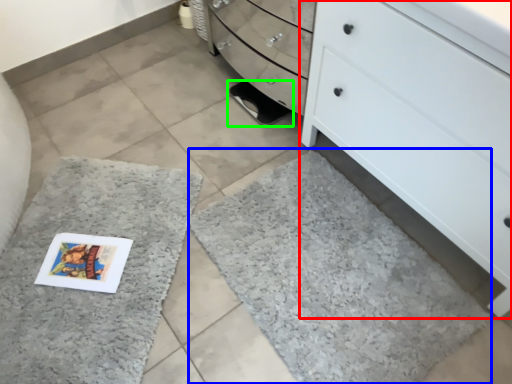
Question: Which object is positioned closest to chest of drawers (highlighted by a red box)? Select from bath mat (highlighted by a blue box) and footwear (highlighted by a green box).

Choices:
 (A) bath mat
 (B) footwear

Answer: (A)